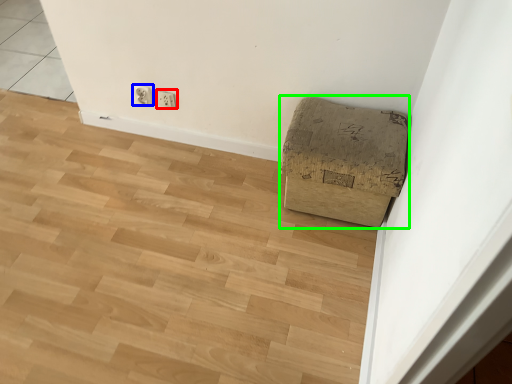
Question: Based on their relative distances, which object is farther from electric outlet (highlighted by a red box)? Choose from electric outlet (highlighted by a blue box) and furniture (highlighted by a green box).

Choices:
 (A) electric outlet
 (B) furniture

Answer: (B)